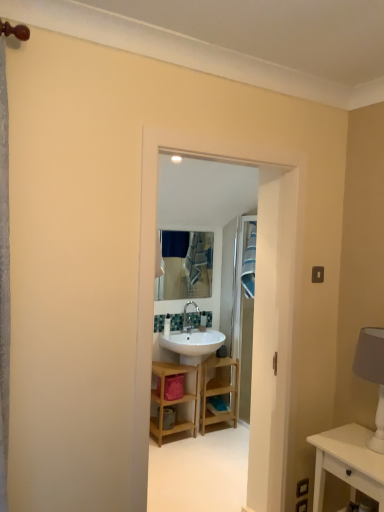
Image resolution: width=384 pixels, height=512 pixels. In order to click on free spot below white fabric lampshade at right (from a real-world perspective) in this screenshot , I will do `click(365, 446)`.